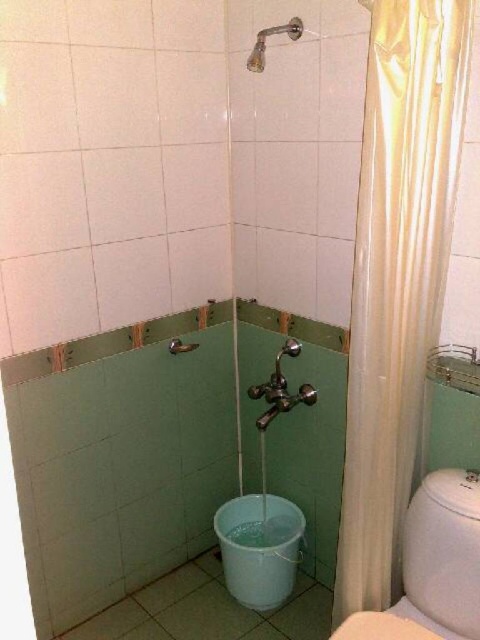
Who is taller, white satin shower curtain at right or white glossy toilet bowl at lower right?

Result: white satin shower curtain at right

Who is lower down, white satin shower curtain at right or white glossy toilet bowl at lower right?

white glossy toilet bowl at lower right is lower down.

Does point (432, 102) come farther from viewer compared to point (428, 576)?

No, it is in front of (428, 576).

Locate an element on the screen. white satin shower curtain at right is located at coordinates (397, 276).

Between white satin shower curtain at right and matte silver shower head at upper center, which one has less height?

Standing shorter between the two is matte silver shower head at upper center.

Who is positioned more to the left, white satin shower curtain at right or matte silver shower head at upper center?

matte silver shower head at upper center

Is point (407, 8) closer to viewer compared to point (285, 32)?

Yes, it is.

This screenshot has width=480, height=640. In order to click on white satin shower curtain at right in this screenshot , I will do `click(397, 276)`.

Which is above, white glossy toilet bowl at lower right or matte silver shower head at upper center?

matte silver shower head at upper center is above.

Does white glossy toilet bowl at lower right have a larger size compared to matte silver shower head at upper center?

Correct, white glossy toilet bowl at lower right is larger in size than matte silver shower head at upper center.

Does point (437, 589) come behind point (279, 33)?

No, (437, 589) is closer to viewer.

I want to click on white glossy toilet bowl at lower right, so click(432, 566).